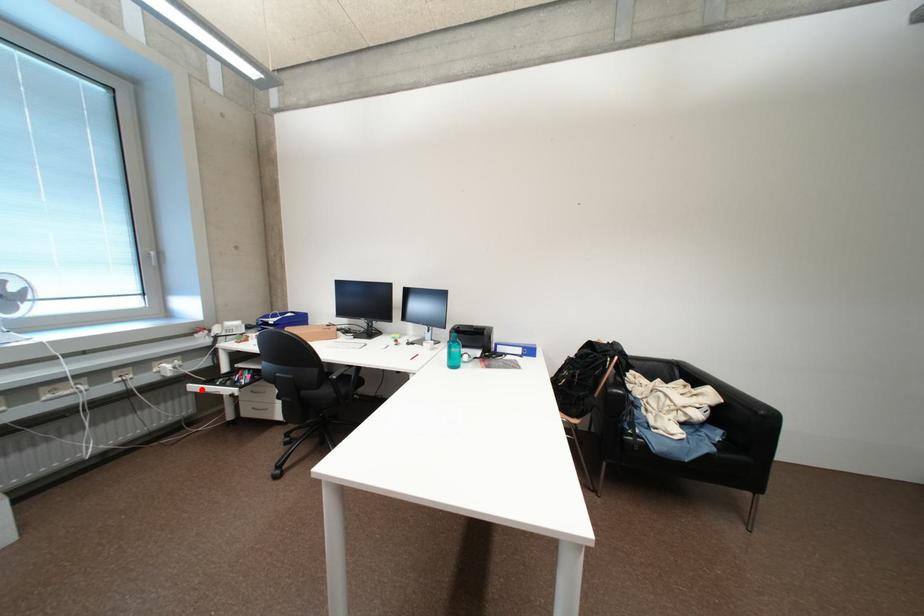
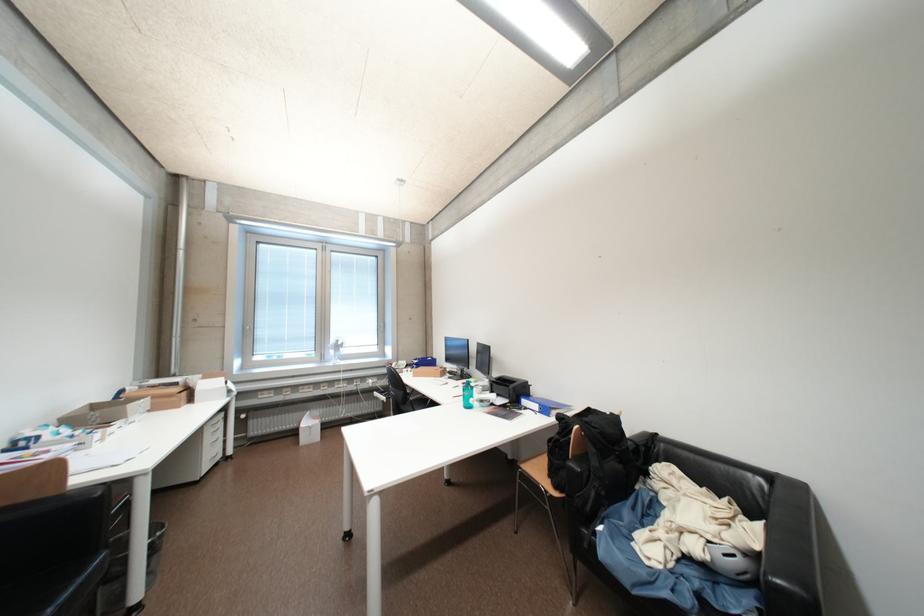
The point at the highlighted location is marked in the first image. Where is the corresponding point in the second image?

(383, 395)